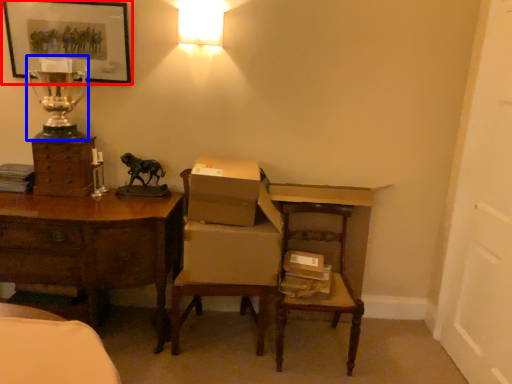
Question: Which point is closer to the camera, picture frame (highlighted by a red box) or table lamp (highlighted by a blue box)?

Choices:
 (A) picture frame
 (B) table lamp

Answer: (B)